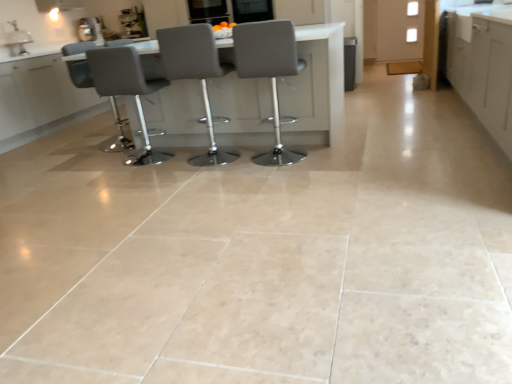
Question: Would you say matte gray table at center is outside gray leather stool at center, the 1th chair from the right?

Choices:
 (A) yes
 (B) no

Answer: (A)

Question: From the image's perspective, is matte gray table at center on gray leather stool at center, the 1th chair from the right?

Choices:
 (A) no
 (B) yes

Answer: (B)

Question: From a real-world perspective, is matte gray table at center on gray leather stool at center, placed as the 4th chair when sorted from left to right?

Choices:
 (A) no
 (B) yes

Answer: (A)

Question: Can you confirm if matte gray table at center is taller than gray leather stool at center, the 1th chair from the right?

Choices:
 (A) no
 (B) yes

Answer: (A)

Question: Is matte gray table at center aimed at gray leather stool at center, placed as the 4th chair when sorted from left to right?

Choices:
 (A) no
 (B) yes

Answer: (A)

Question: From a real-world perspective, is matte gray table at center physically located above or below matte gray chair at center, which is counted as the second chair, starting from the left?

Choices:
 (A) above
 (B) below

Answer: (B)

Question: Is point (261, 134) positioned closer to the camera than point (117, 59)?

Choices:
 (A) farther
 (B) closer

Answer: (A)

Question: From the image's perspective, relative to matte gray chair at center, which ranks as the third chair in right-to-left order, is matte gray table at center above or below?

Choices:
 (A) above
 (B) below

Answer: (A)

Question: Considering the positions of matte gray table at center and matte gray chair at center, which ranks as the third chair in right-to-left order, in the image, is matte gray table at center wider or thinner than matte gray chair at center, which ranks as the third chair in right-to-left order,?

Choices:
 (A) thin
 (B) wide

Answer: (B)

Question: Based on their positions, is white matte cabinet at upper right, which is the first cabinetry from top to bottom, located to the left or right of white matte cabinet at right, positioned as the first cabinetry in front-to-back order?

Choices:
 (A) right
 (B) left

Answer: (A)

Question: Is white matte cabinet at upper right, which ranks as the second cabinetry in front-to-back order, inside or outside of white matte cabinet at right, the 2th cabinetry viewed from the top?

Choices:
 (A) inside
 (B) outside

Answer: (B)

Question: Is white matte cabinet at upper right, which ranks as the second cabinetry in front-to-back order, wider or thinner than white matte cabinet at right, positioned as the first cabinetry in front-to-back order?

Choices:
 (A) wide
 (B) thin

Answer: (B)

Question: Does point (412, 8) appear closer or farther from the camera than point (506, 91)?

Choices:
 (A) closer
 (B) farther

Answer: (B)

Question: In terms of width, does white glossy sink at upper left look wider or thinner when compared to matte gray chair at center, arranged as the second chair when viewed from the right?

Choices:
 (A) thin
 (B) wide

Answer: (A)

Question: From the image's perspective, relative to matte gray chair at center, arranged as the second chair when viewed from the right, is white glossy sink at upper left above or below?

Choices:
 (A) above
 (B) below

Answer: (A)